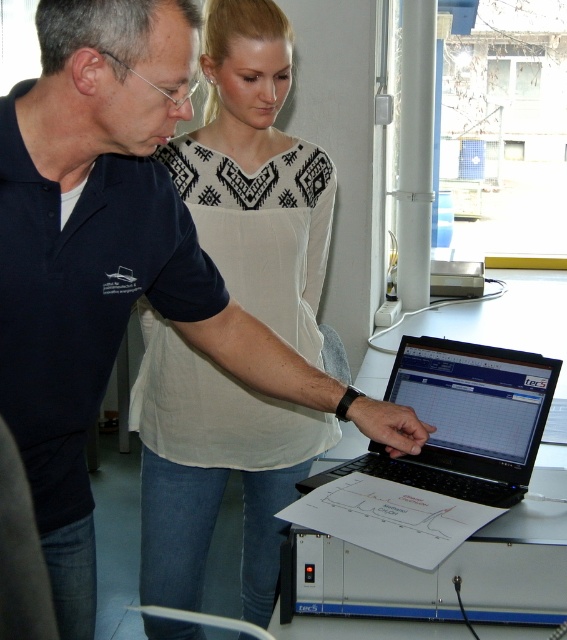
You are standing in front of the laptop and want to reach the point marked at coordinates (x=268, y=465). If your arm can reach 1.5 meters, can you touch that point without moving closer?

The point marked at coordinates (x=268, y=465) is 1.80 meters away from the viewer. Since your arm can only reach 1.5 meters, you cannot touch that point without moving closer.

You are a photographer trying to capture a clear shot of the black plastic laptop at center and the white printed blouse at upper center. Since you want both subjects in focus, you need to know their distance from each other. Based on the scene, can you determine if they are close enough for the camera to focus on both without adjusting the lens?

The white printed blouse at upper center is positioned on the left side of black plastic laptop at center, but the exact distance between them isn not provided. However, since both are part of the same scene and positioned near each other in the image, it is likely they are within the camera s depth of field without needing lens adjustment.